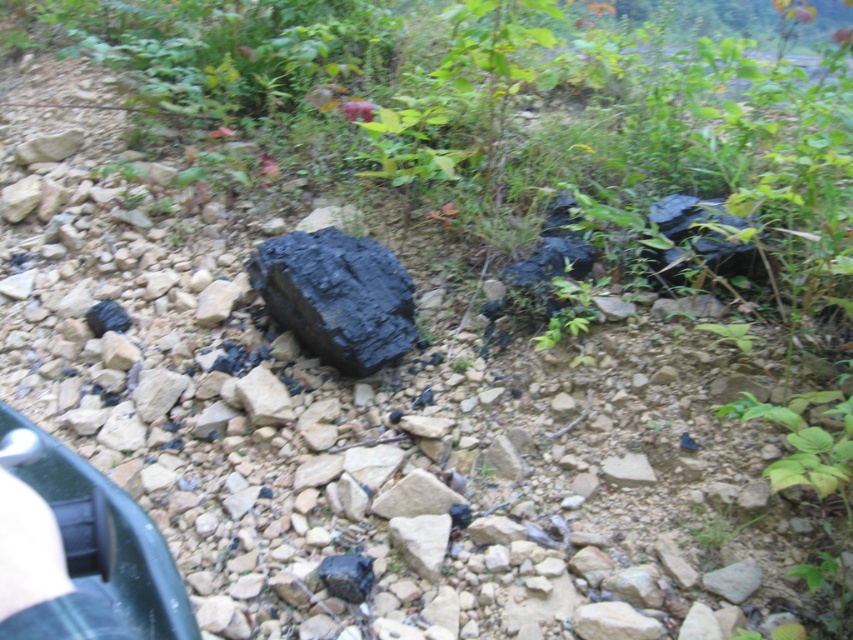
Can you confirm if black matte rock at center is positioned to the right of blue denim jeans at lower left?

Correct, you'll find black matte rock at center to the right of blue denim jeans at lower left.

Does black matte rock at center have a greater height compared to blue denim jeans at lower left?

Yes.

Where is `black matte rock at center`? This screenshot has width=853, height=640. black matte rock at center is located at coordinates [337, 296].